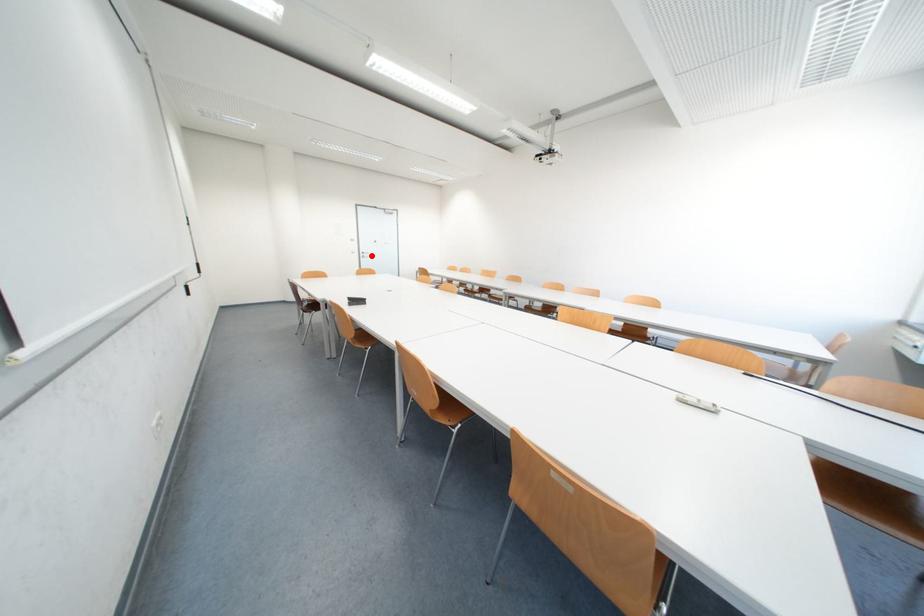
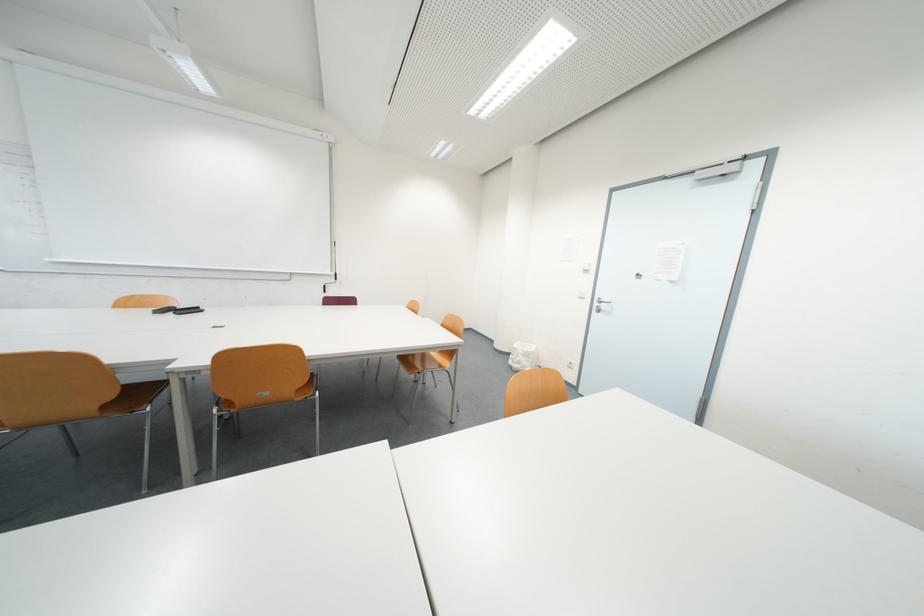
Question: A red point is marked in image1. In image2, is the corresponding 3D point closer to the camera or farther? Reply with the corresponding letter.

Choices:
 (A) The corresponding 3D point is closer.
 (B) The corresponding 3D point is farther.

Answer: (B)